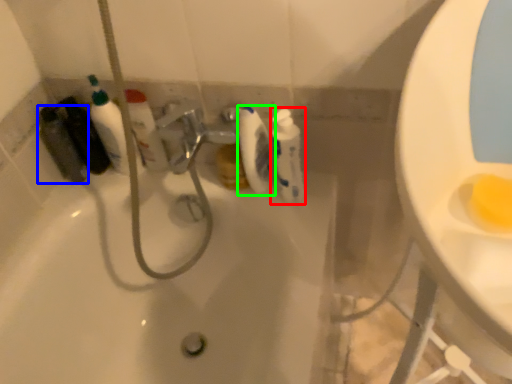
Question: Considering the real-world distances, which object is closest to cleaning product (highlighted by a red box)? mouthwash (highlighted by a blue box) or toilet paper (highlighted by a green box).

Choices:
 (A) mouthwash
 (B) toilet paper

Answer: (B)